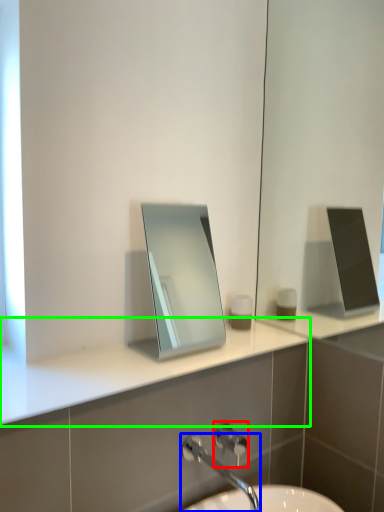
Question: Which is farther away from shower (highlighted by a red box)? tap (highlighted by a blue box) or counter top (highlighted by a green box)?

Choices:
 (A) tap
 (B) counter top

Answer: (B)